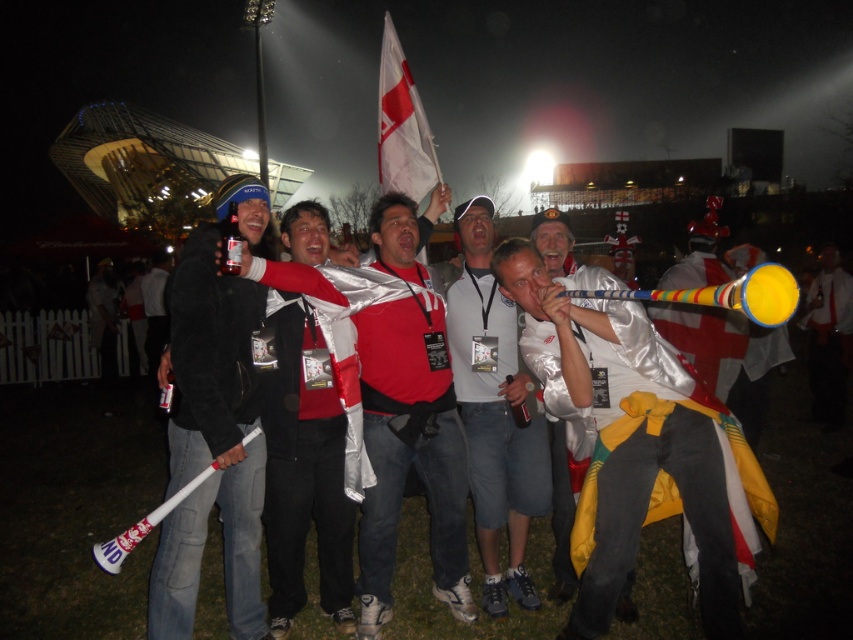
Question: Is white matte shirt at center wider than metallic silver flag at center?

Choices:
 (A) yes
 (B) no

Answer: (B)

Question: Among these points, which one is nearest to the camera?

Choices:
 (A) (651, 312)
 (B) (404, 170)
 (C) (186, 426)

Answer: (C)

Question: Can you confirm if shiny silver jacket at center is wider than metallic silver flag at center?

Choices:
 (A) yes
 (B) no

Answer: (B)

Question: Which point appears farthest from the camera in this image?

Choices:
 (A) (701, 241)
 (B) (544, 264)
 (C) (532, 282)

Answer: (A)

Question: From the image, what is the correct spatial relationship of shiny silver jacket at center in relation to silver metallic jacket at center?

Choices:
 (A) above
 (B) below

Answer: (B)

Question: Which of the following is the farthest from the observer?

Choices:
 (A) (189, 632)
 (B) (564, 436)
 (C) (381, 186)

Answer: (C)